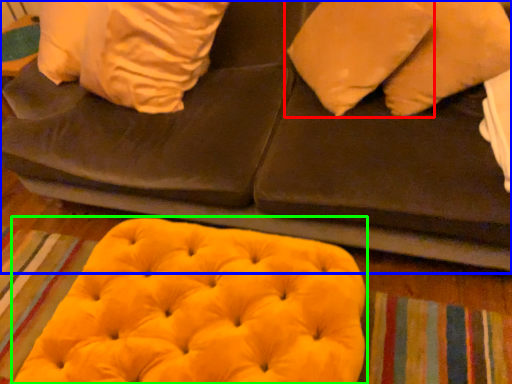
Question: Considering the real-world distances, which object is closest to pillow (highlighted by a red box)? furniture (highlighted by a blue box) or bean bag chair (highlighted by a green box).

Choices:
 (A) furniture
 (B) bean bag chair

Answer: (A)